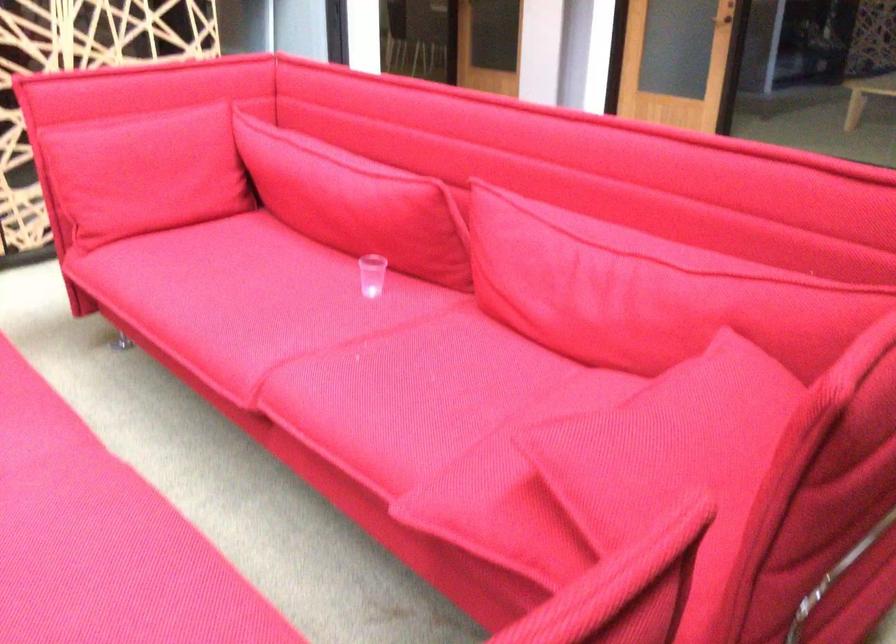
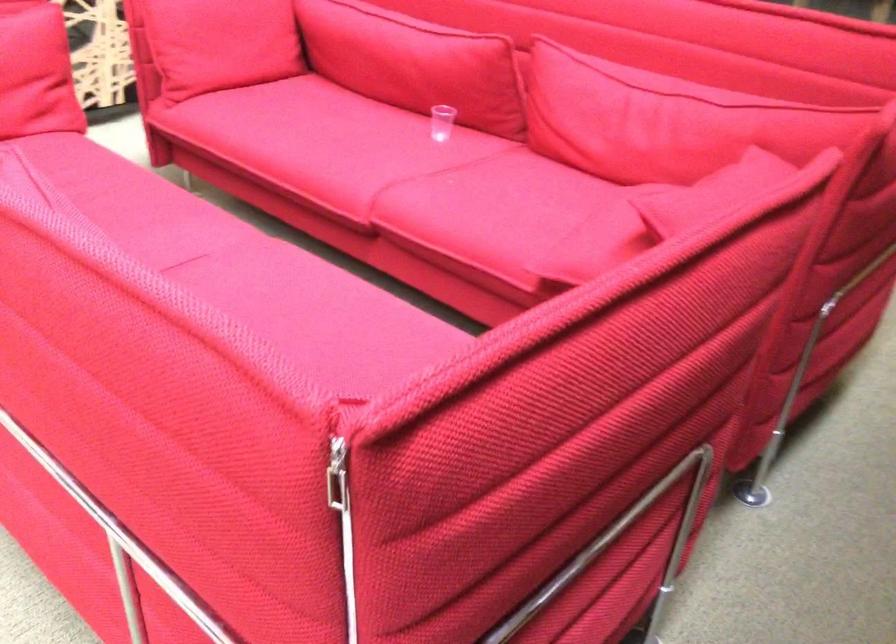
Find the pixel in the second image that matches the point at 221,308 in the first image.

(320, 146)